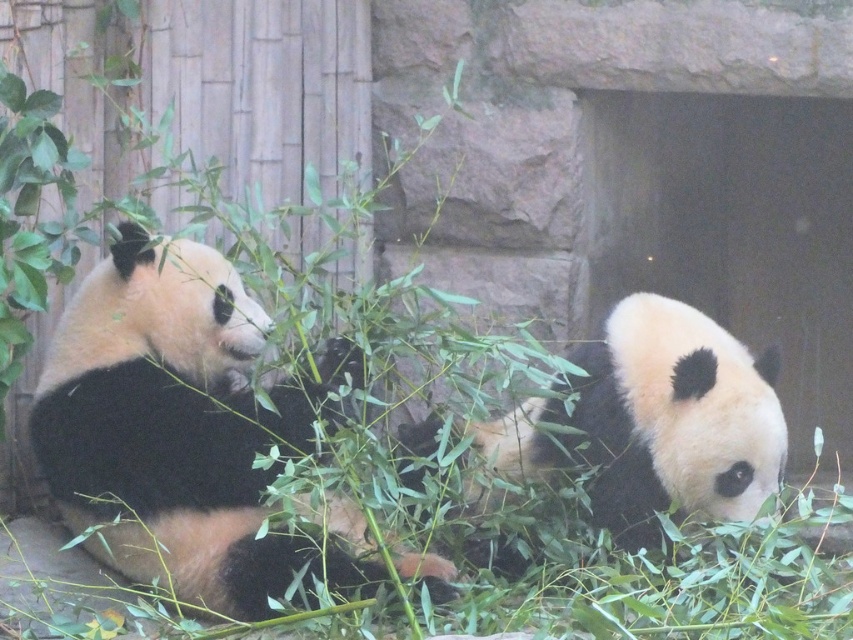
You are a zookeeper observing two pandas in their enclosure. You notice the black fur panda at center and the black fur panda at right. Which panda has a greater width?

The black fur panda at center has a greater width than the black fur panda at right, as stated in the description.

You are a zookeeper observing two pandas in their enclosure. You notice the black fur panda at center and the black fur panda at right. Which panda is located directly above the other?

The black fur panda at right is positioned above the black fur panda at center.